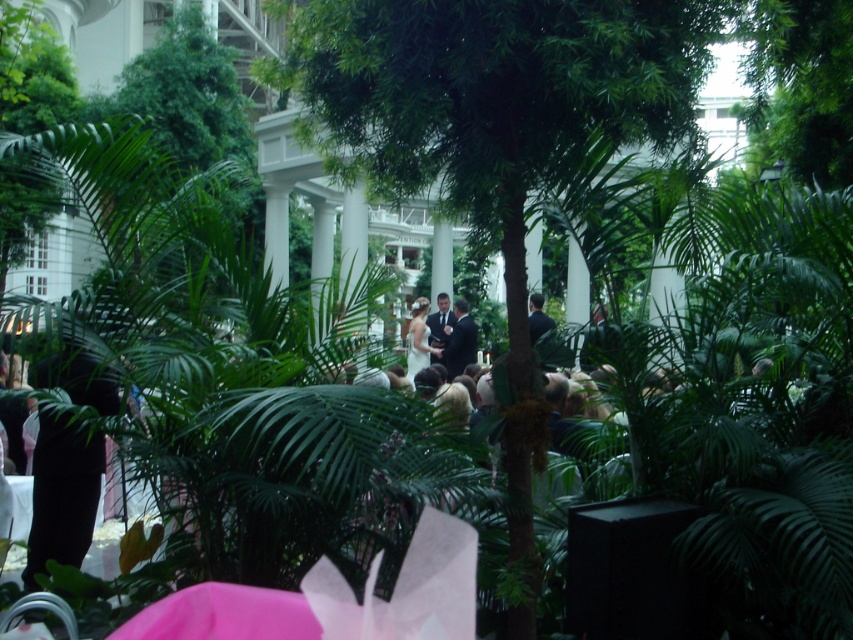
Question: Which object appears closest to the camera in this image?

Choices:
 (A) dark suit at center
 (B) white satin dress at center

Answer: (A)

Question: In this image, where is dark suit at center located relative to white satin dress at center?

Choices:
 (A) left
 (B) right

Answer: (B)

Question: Does dark suit at center appear over white satin dress at center?

Choices:
 (A) yes
 (B) no

Answer: (B)

Question: Which object appears farthest from the camera in this image?

Choices:
 (A) dark suit at center
 (B) white satin dress at center

Answer: (B)

Question: Observing the image, what is the correct spatial positioning of dark suit at center in reference to white satin dress at center?

Choices:
 (A) left
 (B) right

Answer: (B)

Question: Which point is closer to the camera?

Choices:
 (A) white satin dress at center
 (B) dark suit at center

Answer: (B)